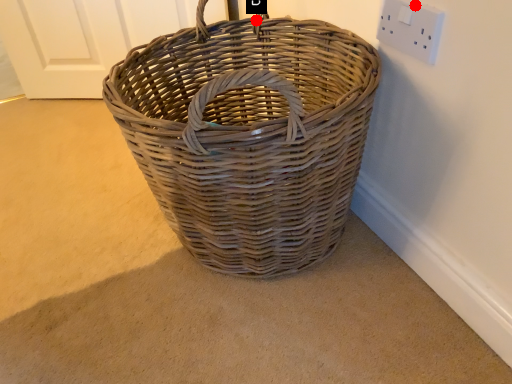
Question: Two points are circled on the image, labeled by A and B beside each circle. Which point is farther to the camera?

Choices:
 (A) A is further
 (B) B is further

Answer: (B)